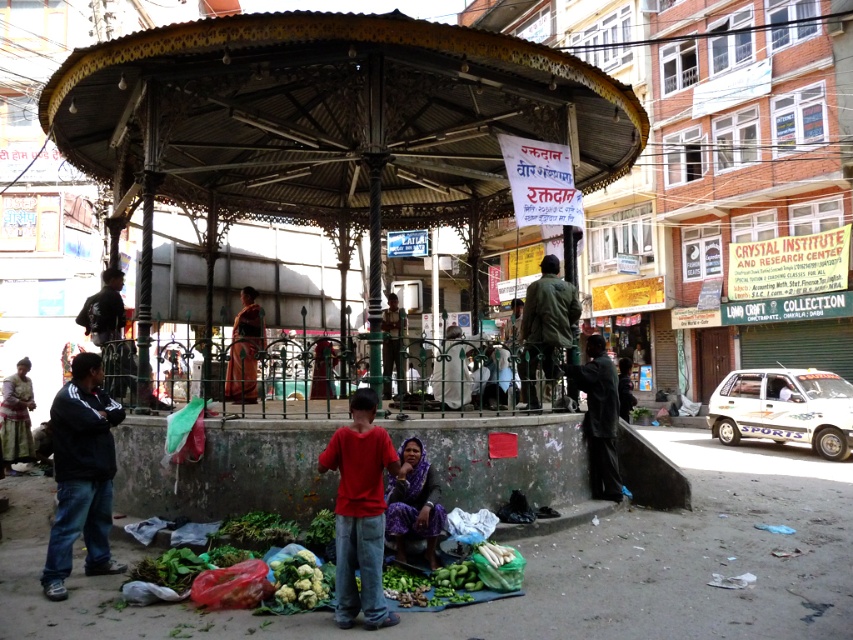
Does point (553, 276) lie in front of point (422, 451)?

No, (553, 276) is further to viewer.

Does green matte jacket at center appear over printed fabric dress at center?

Indeed, green matte jacket at center is positioned over printed fabric dress at center.

Measure the distance between green matte jacket at center and camera.

A distance of 27.88 feet exists between green matte jacket at center and camera.

Locate an element on the screen. This screenshot has width=853, height=640. green matte jacket at center is located at coordinates (546, 323).

Is red cotton shirt at center to the left of printed fabric dress at center from the viewer's perspective?

Correct, you'll find red cotton shirt at center to the left of printed fabric dress at center.

Does red cotton shirt at center have a lesser height compared to printed fabric dress at center?

No.

This screenshot has height=640, width=853. What are the coordinates of `red cotton shirt at center` in the screenshot? It's located at (360, 512).

The height and width of the screenshot is (640, 853). In order to click on red cotton shirt at center in this screenshot , I will do `click(360, 512)`.

In the scene shown: Is printed fabric dress at center to the left of orange fabric cloth at center from the viewer's perspective?

No, printed fabric dress at center is not to the left of orange fabric cloth at center.

Based on the photo, does printed fabric dress at center have a larger size compared to orange fabric cloth at center?

No.

Who is more distant from viewer, (409,531) or (239,362)?

Positioned behind is point (239,362).

Locate an element on the screen. printed fabric dress at center is located at coordinates (413, 502).